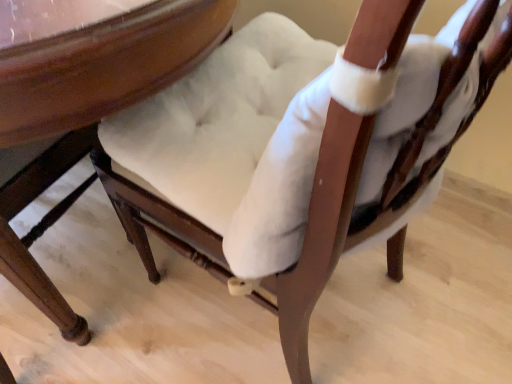
Describe the element at coordinates (87, 112) in the screenshot. The width and height of the screenshot is (512, 384). I see `white tufted cushion at center` at that location.

Locate an element on the screen. white tufted cushion at center is located at coordinates (87, 112).

Image resolution: width=512 pixels, height=384 pixels. What are the coordinates of `white tufted cushion at center` in the screenshot? It's located at 87,112.